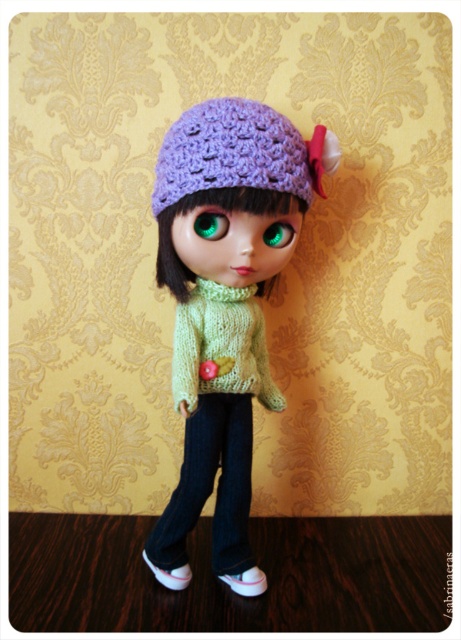
You are standing in front of the doll displayed against the yellow damask wall. You notice a specific point at coordinates (170, 573). Which object from the scene is located at this point?

The point at coordinates (170, 573) indicates the white matte shoe at lower left.

Looking at the doll in the image, which eye is positioned to the left of the other between the green glossy eye at center and the green matte eye at center?

The green glossy eye at center is positioned to the left of the green matte eye at center.